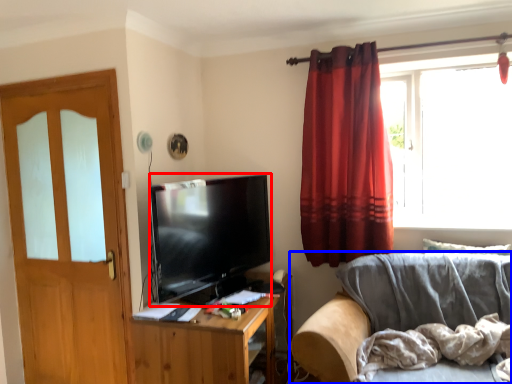
Question: Which point is further to the camera, television (highlighted by a red box) or studio couch (highlighted by a blue box)?

Choices:
 (A) television
 (B) studio couch

Answer: (A)